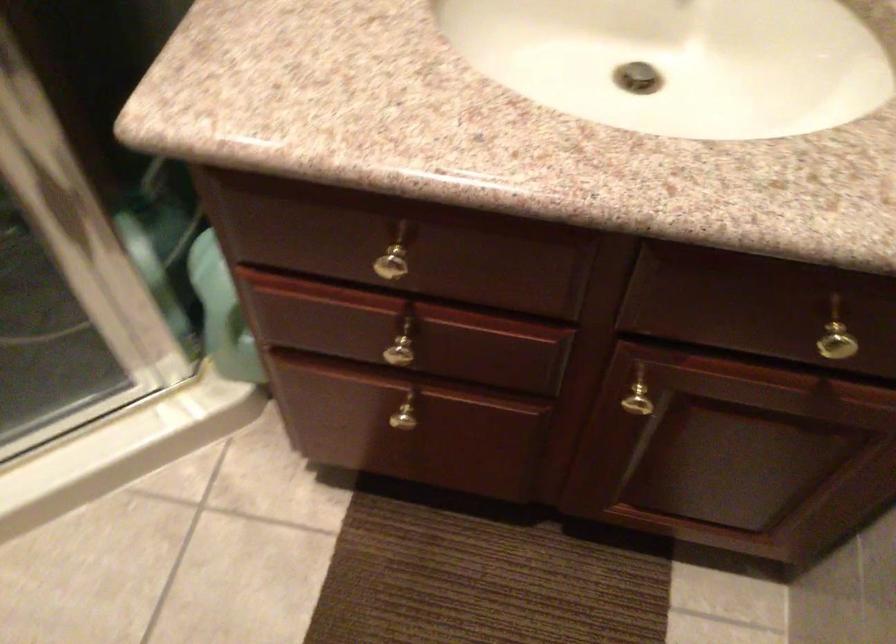
Find the location of `gold cabinet knob`. gold cabinet knob is located at coordinates (837, 343).